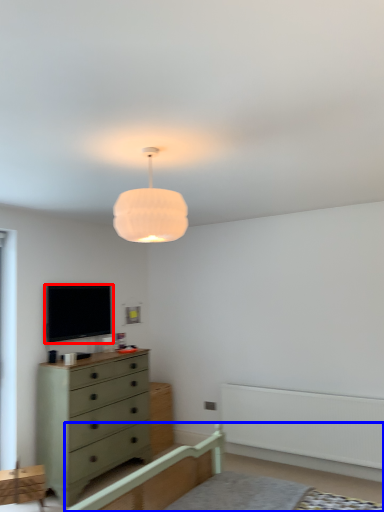
Question: Which object appears farthest to the camera in this image, television (highlighted by a red box) or bed frame (highlighted by a blue box)?

Choices:
 (A) television
 (B) bed frame

Answer: (A)